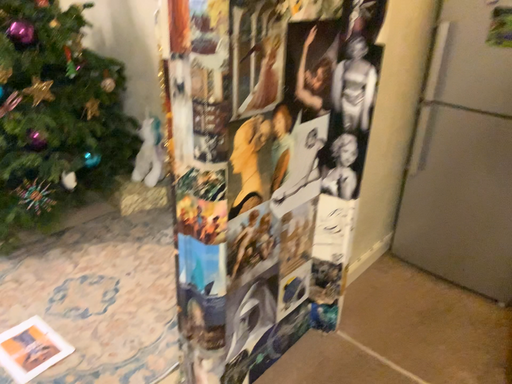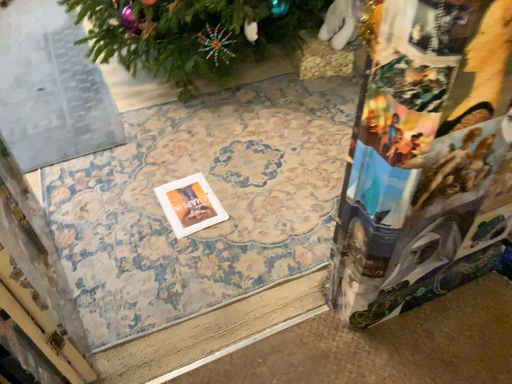
Question: Which way did the camera rotate in the video?

Choices:
 (A) rotated right
 (B) rotated left

Answer: (B)